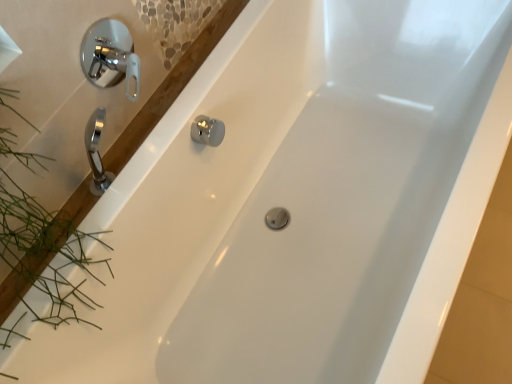
Question: Should I look upward or downward to see chrome/metallic shower handle at upper left?

Choices:
 (A) down
 (B) up

Answer: (B)